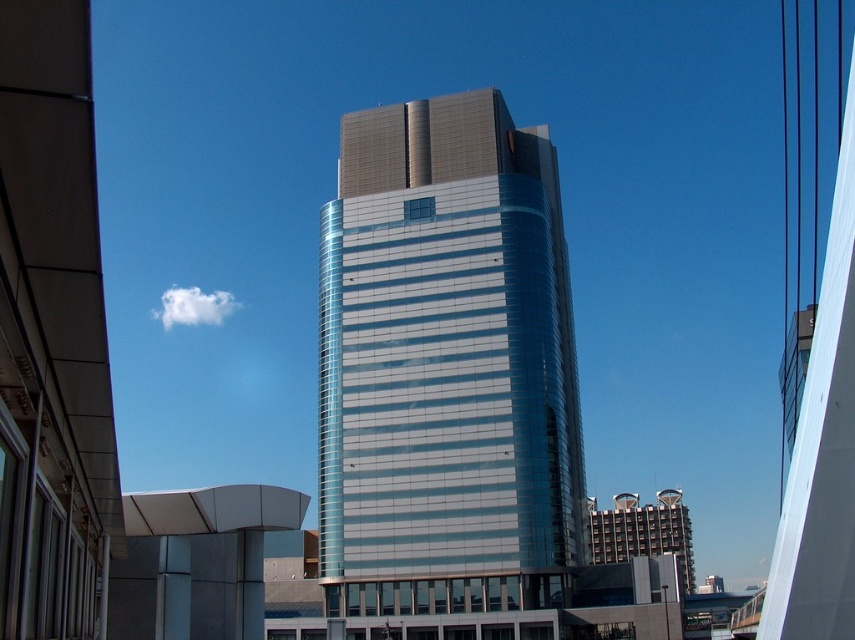
You are a drone operator tasked with flying a drone between the shiny glass tower at center and the metallic silver building at lower right. The drone has a maximum flight distance of 50 meters. Can the drone safely fly between them without exceeding its range?

The distance between the shiny glass tower at center and the metallic silver building at lower right is 44.06 meters, which is within the drone operator maximum flight distance of 50 meters. The drone can safely fly between them without exceeding its range.

You are standing on the sidewalk in front of the shiny glass tower at center and the metallic silver building at lower right. Which building is closer to you?

The shiny glass tower at center is closer to you because it is in front of the metallic silver building at lower right.